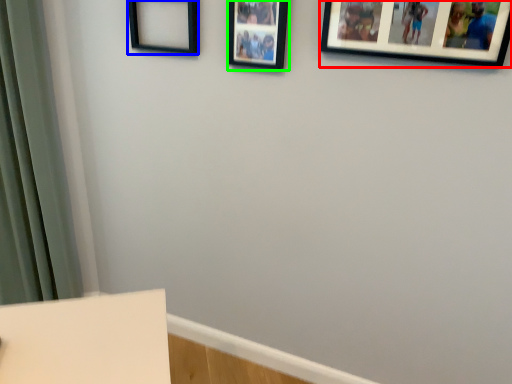
Question: Which object is the closest to the picture frame (highlighted by a red box)? Choose among these: picture frame (highlighted by a blue box) or picture frame (highlighted by a green box).

Choices:
 (A) picture frame
 (B) picture frame

Answer: (B)